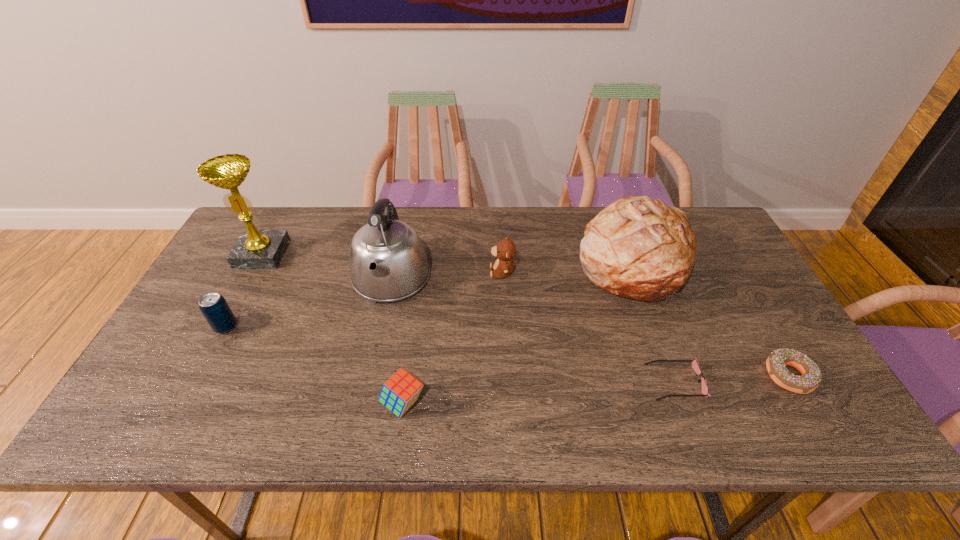
Locate an element on the screen. Image resolution: width=960 pixels, height=540 pixels. free region located 0.250m on the bridge of the shortest object is located at coordinates (543, 382).

The height and width of the screenshot is (540, 960). Identify the location of award located at the far edge. (255, 249).

Image resolution: width=960 pixels, height=540 pixels. What are the coordinates of `kettle present at the far edge` in the screenshot? It's located at (387, 260).

In order to click on bread that is at the far edge in this screenshot , I will do `click(639, 248)`.

The width and height of the screenshot is (960, 540). I want to click on cube that is at the near edge, so click(401, 391).

Locate an element on the screen. sunglasses located at the near edge is located at coordinates (695, 365).

Locate an element on the screen. The width and height of the screenshot is (960, 540). award at the left edge is located at coordinates (255, 249).

The height and width of the screenshot is (540, 960). In order to click on soda can that is at the left edge in this screenshot , I will do `click(213, 306)`.

Where is `bread present at the right edge`? The width and height of the screenshot is (960, 540). bread present at the right edge is located at coordinates (639, 248).

At what (x,y) coordinates should I click in order to perform the action: click on doughnut present at the right edge. Please return your answer as a coordinate pair (x, y). The width and height of the screenshot is (960, 540). Looking at the image, I should click on tap(776, 363).